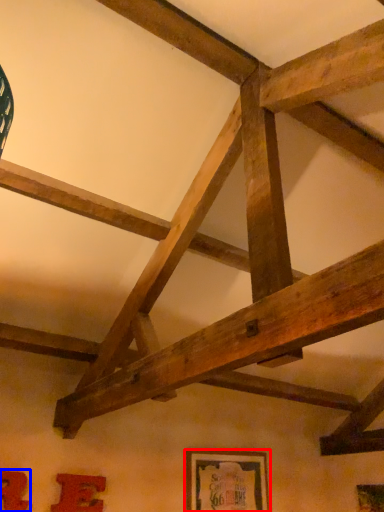
Question: Which point is further to the camera, picture frame (highlighted by a red box) or picture frame (highlighted by a blue box)?

Choices:
 (A) picture frame
 (B) picture frame

Answer: (A)